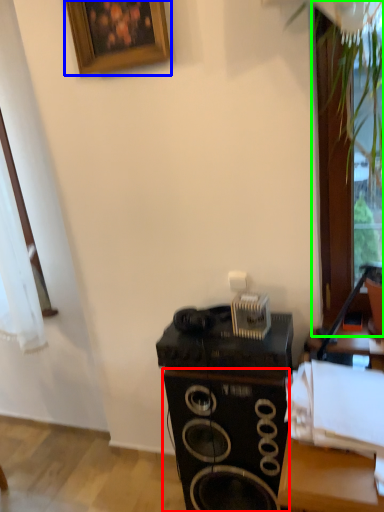
Question: Based on their relative distances, which object is farther from speaker (highlighted by a red box)? Choose from picture frame (highlighted by a blue box) and glass door (highlighted by a green box).

Choices:
 (A) picture frame
 (B) glass door

Answer: (A)